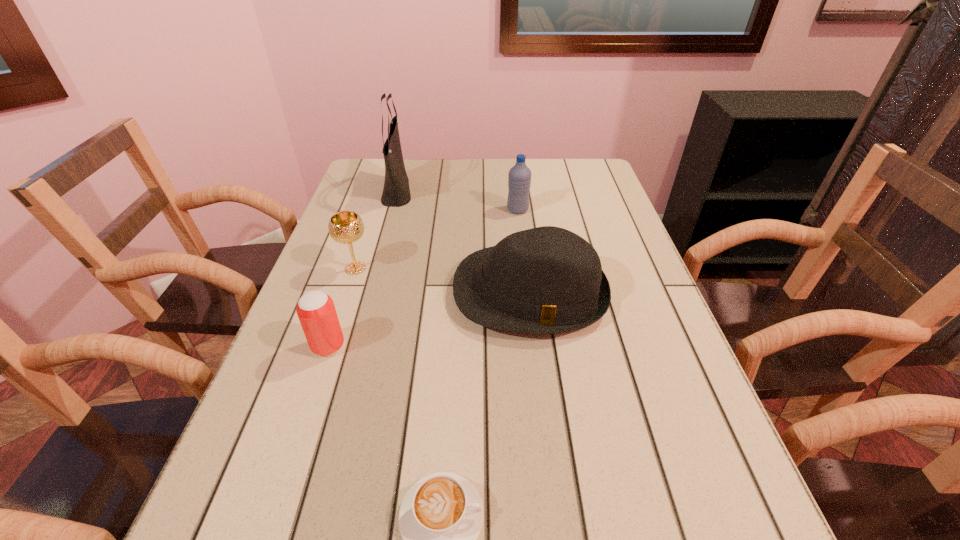
Where is `object present at the far edge`? This screenshot has height=540, width=960. object present at the far edge is located at coordinates (396, 192).

At what (x,y) coordinates should I click in order to perform the action: click on shoulder bag located at the left edge. Please return your answer as a coordinate pair (x, y). Looking at the image, I should click on (396, 192).

Identify the location of chalice present at the left edge. (346, 227).

Locate an element on the screen. This screenshot has height=540, width=960. beer can present at the left edge is located at coordinates (316, 311).

Where is `object at the right edge`? object at the right edge is located at coordinates (547, 280).

Find the location of a particular element. Image resolution: width=960 pixels, height=540 pixels. object situated at the far left corner is located at coordinates (396, 192).

Locate an element on the screen. free space at the far edge of the desktop is located at coordinates (485, 188).

You are a GUI agent. You are given a task and a screenshot of the screen. Output one action in this format:
    pyautogui.click(x=<x>, y=<y>)
    Task: Click on the free space at the left edge
    This screenshot has height=540, width=960.
    Given the screenshot: What is the action you would take?
    pyautogui.click(x=357, y=280)

At what (x,y) coordinates should I click in order to perform the action: click on vacant space at the right edge of the desktop. Please return your answer as a coordinate pair (x, y). Looking at the image, I should click on (644, 348).

This screenshot has width=960, height=540. Identify the location of free space at the far left corner. (408, 158).